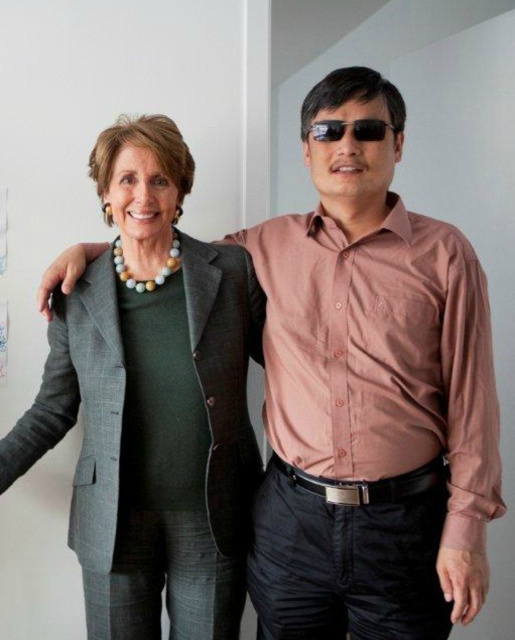
Which is in front, point (197, 468) or point (365, 129)?

Point (365, 129)

Based on the photo, is matte gray blazer at center wider than black plastic sunglasses at center?

Yes, matte gray blazer at center is wider than black plastic sunglasses at center.

I want to click on matte gray blazer at center, so click(152, 403).